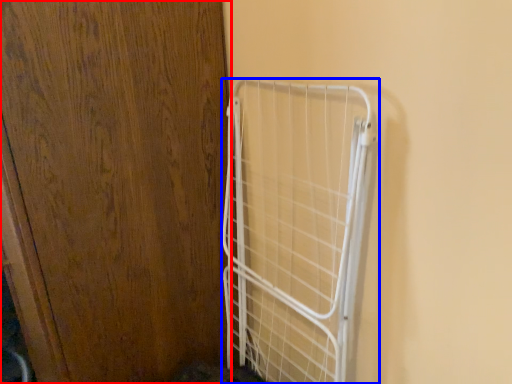
Question: Which object appears farthest to the camera in this image, door (highlighted by a red box) or cage (highlighted by a blue box)?

Choices:
 (A) door
 (B) cage

Answer: (B)